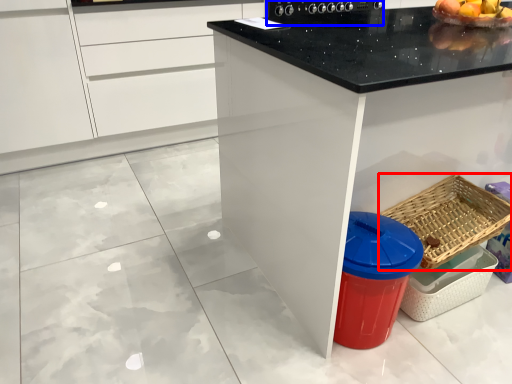
Question: Which of the following is the closest to the observer, basket (highlighted by a red box) or appliance (highlighted by a blue box)?

Choices:
 (A) basket
 (B) appliance

Answer: (A)